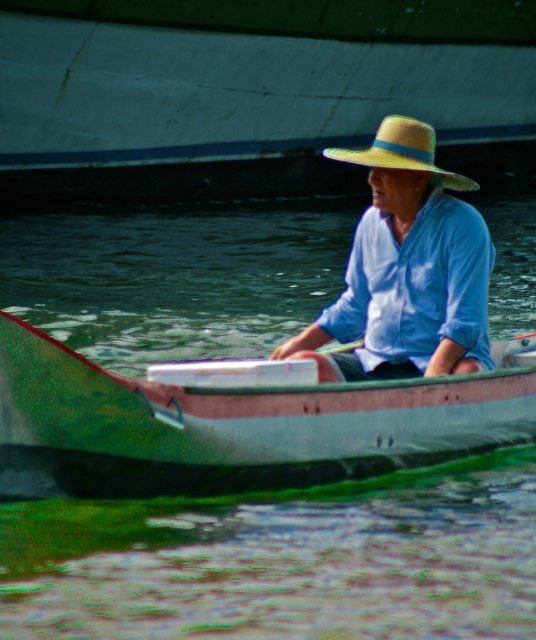
Can you confirm if green painted wood boat at center is taller than green painted wood canoe at center?

Correct, green painted wood boat at center is much taller as green painted wood canoe at center.

Where is `green painted wood boat at center`? green painted wood boat at center is located at coordinates (251, 92).

At what (x,y) coordinates should I click in order to perform the action: click on green painted wood boat at center. Please return your answer as a coordinate pair (x, y). Looking at the image, I should click on (251, 92).

Between green painted wood boat at center and light blue cotton shirt at center, which one is positioned higher?

Positioned higher is green painted wood boat at center.

Which is more to the left, green painted wood boat at center or light blue cotton shirt at center?

From the viewer's perspective, green painted wood boat at center appears more on the left side.

Based on the photo, measure the distance between green painted wood boat at center and camera.

107.84 feet

Locate an element on the screen. This screenshot has width=536, height=640. green painted wood boat at center is located at coordinates (251, 92).

Does green matte water at center appear over natural straw hat at center?

No.

Between green matte water at center and natural straw hat at center, which one has more height?

Standing taller between the two is green matte water at center.

Between point (167, 573) and point (456, 176), which one is positioned behind?

The point (456, 176) is behind.

This screenshot has height=640, width=536. Identify the location of green matte water at center. (284, 561).